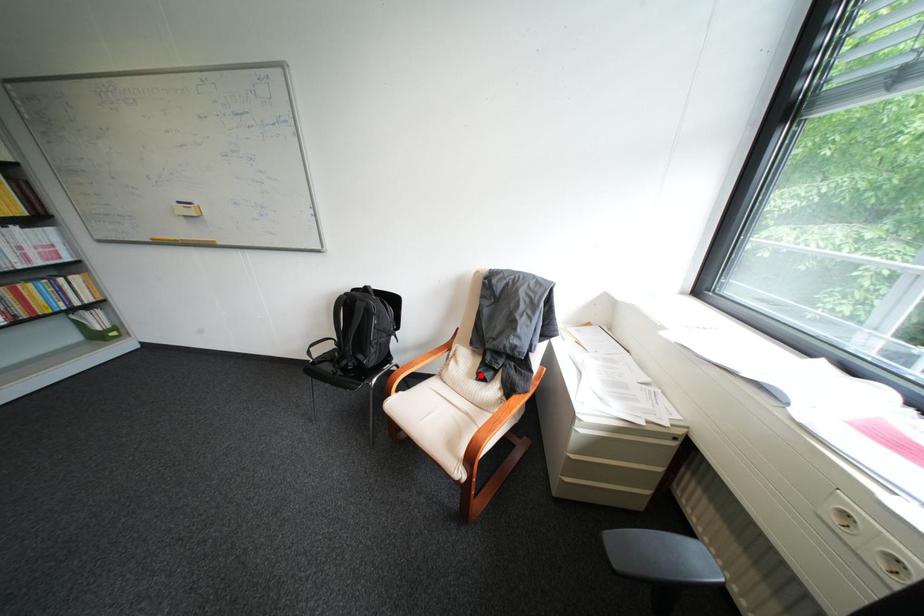
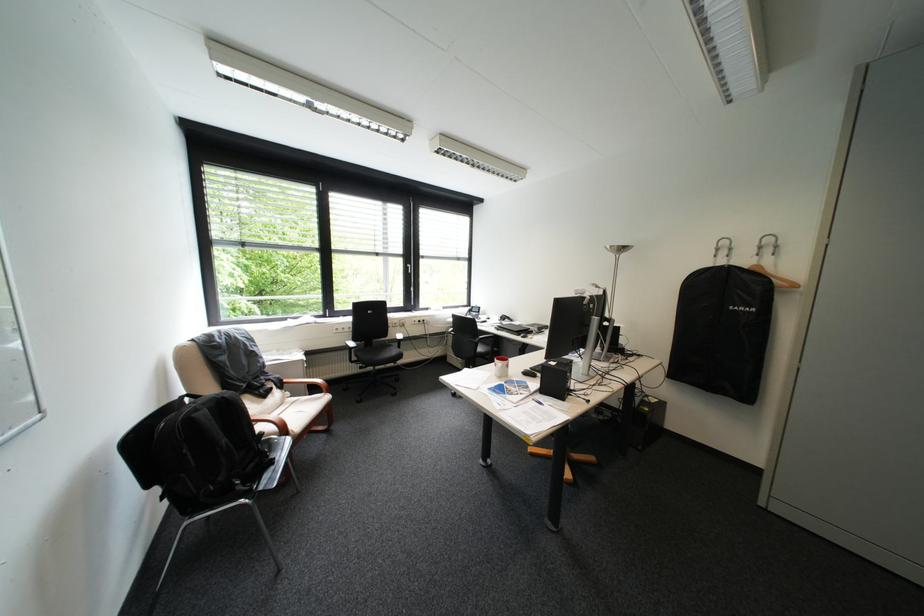
Question: I am providing you with two images of the same scene from different viewpoints. A red point is shown in image1. For the corresponding object point in image2, is it positioned nearer or farther from the camera?

Choices:
 (A) Nearer
 (B) Farther

Answer: (A)